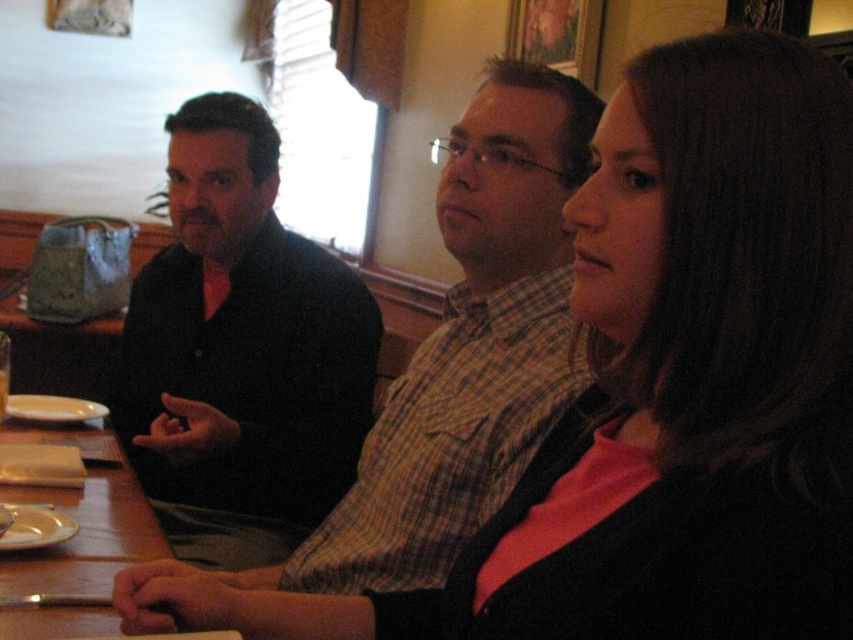
You are a server who needs to place a new drink on the table without covering any existing items. Given the wooden table at lower left and the white glossy plate at lower left, which object should you avoid placing the drink on?

You should avoid placing the drink on the white glossy plate at lower left because the wooden table at lower left is positioned over it, meaning the plate is underneath the table and not accessible for placing items.

You are a photographer setting up a shoot at the table where the black matte shirt at left and the white glossy plate at lower left are present. You need to ensure that the object with the larger width is placed in the center of the frame. Which object should you position centrally?

The black matte shirt at left should be positioned centrally because its width surpasses that of the white glossy plate at lower left.

You are a server at a restaurant and need to place a new order for the person seated at the wooden table at lower left. Where should you place the plate relative to the white matte plate at lower left?

The wooden table at lower left is to the right of the white matte plate at lower left, so you should place the new plate to the right side of the white matte plate at lower left on the wooden table at lower left.